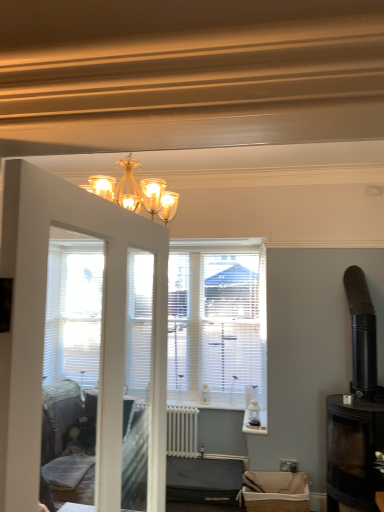
Question: Is burlap basket at lower center, marked as the 2th furniture in a back-to-front arrangement, looking in the opposite direction of gold metallic chandelier at upper center?

Choices:
 (A) no
 (B) yes

Answer: (A)

Question: Is burlap basket at lower center, placed as the first furniture when sorted from right to left, next to gold metallic chandelier at upper center?

Choices:
 (A) no
 (B) yes

Answer: (A)

Question: Is burlap basket at lower center, the first furniture positioned from the front, located outside gold metallic chandelier at upper center?

Choices:
 (A) yes
 (B) no

Answer: (A)

Question: From the image's perspective, does burlap basket at lower center, marked as the 2th furniture in a back-to-front arrangement, appear higher than gold metallic chandelier at upper center?

Choices:
 (A) no
 (B) yes

Answer: (A)

Question: Is burlap basket at lower center, placed as the first furniture when sorted from right to left, far away from gold metallic chandelier at upper center?

Choices:
 (A) no
 (B) yes

Answer: (B)

Question: Is burlap basket at lower center, the first furniture positioned from the front, taller than gold metallic chandelier at upper center?

Choices:
 (A) no
 (B) yes

Answer: (A)

Question: Considering the relative sizes of white painted radiator at center and burlap basket at lower center, placed as the first furniture when sorted from right to left, in the image provided, is white painted radiator at center smaller than burlap basket at lower center, placed as the first furniture when sorted from right to left,?

Choices:
 (A) yes
 (B) no

Answer: (A)

Question: Is white painted radiator at center shorter than burlap basket at lower center, the first furniture positioned from the front?

Choices:
 (A) yes
 (B) no

Answer: (B)

Question: From the image's perspective, does white painted radiator at center appear lower than burlap basket at lower center, the first furniture positioned from the front?

Choices:
 (A) no
 (B) yes

Answer: (A)

Question: Is burlap basket at lower center, placed as the first furniture when sorted from right to left, completely or partially inside white painted radiator at center?

Choices:
 (A) no
 (B) yes

Answer: (A)

Question: Is white painted radiator at center facing away from burlap basket at lower center, placed as the first furniture when sorted from right to left?

Choices:
 (A) no
 (B) yes

Answer: (A)

Question: From a real-world perspective, is white painted radiator at center beneath burlap basket at lower center, marked as the 2th furniture in a back-to-front arrangement?

Choices:
 (A) yes
 (B) no

Answer: (B)

Question: From a real-world perspective, is black glass fireplace at right physically below burlap basket at lower center, the first furniture positioned from the front?

Choices:
 (A) yes
 (B) no

Answer: (B)